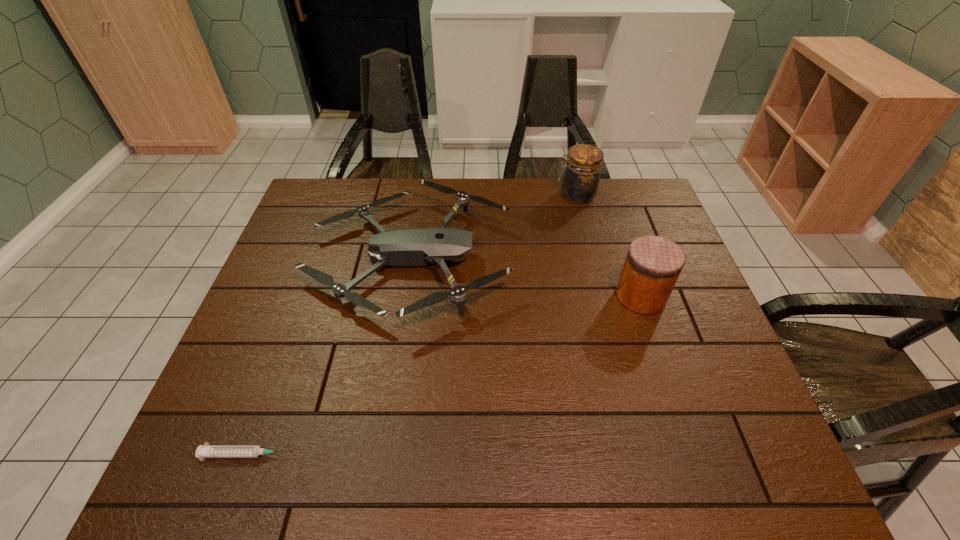
The image size is (960, 540). I want to click on free space between the farther jar and the drone, so click(x=492, y=227).

Where is `free spot between the nearer jar and the farther jar`? This screenshot has width=960, height=540. free spot between the nearer jar and the farther jar is located at coordinates (609, 246).

This screenshot has width=960, height=540. I want to click on unoccupied position between the nearer jar and the shortest object, so click(x=444, y=375).

Identify the location of free space between the third tallest object and the farther jar. This screenshot has height=540, width=960. (492, 227).

Identify which object is the closest to the nearer jar. Please provide its 2D coordinates. Your answer should be formatted as a tuple, i.e. [(x, y)], where the tuple contains the x and y coordinates of a point satisfying the conditions above.

[(405, 247)]

Where is `the closest object relative to the farther jar`? the closest object relative to the farther jar is located at coordinates (405, 247).

The height and width of the screenshot is (540, 960). I want to click on vacant area that satisfies the following two spatial constraints: 1. on the back side of the nearer jar; 2. on the lid of the farther jar, so click(607, 195).

At what (x,y) coordinates should I click in order to perform the action: click on free point that satisfies the following two spatial constraints: 1. on the lid of the nearer jar; 2. on the right side of the farther jar. Please return your answer as a coordinate pair (x, y). Image resolution: width=960 pixels, height=540 pixels. Looking at the image, I should click on (602, 296).

This screenshot has height=540, width=960. I want to click on free location that satisfies the following two spatial constraints: 1. on the back side of the nearer jar; 2. on the lid of the farther jar, so click(607, 195).

This screenshot has height=540, width=960. I want to click on free location that satisfies the following two spatial constraints: 1. with a camera mounted on the front of the nearer jar; 2. on the right side of the drone, so click(403, 296).